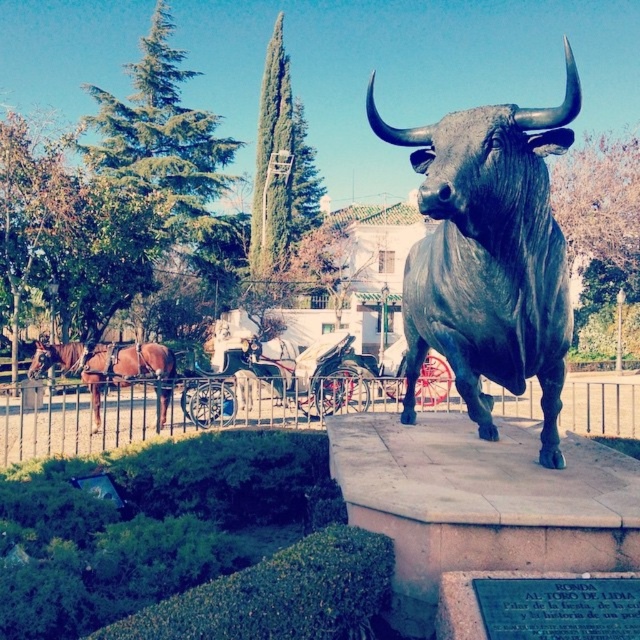
Is point (541, 460) in front of point (164, 392)?

Yes, point (541, 460) is closer to viewer.

Between shiny bronze bull at center and brown leather horse at left, which one has less height?

brown leather horse at left

Measure the distance between shiny bronze bull at center and camera.

shiny bronze bull at center and camera are 10.80 feet apart.

I want to click on shiny bronze bull at center, so click(x=490, y=253).